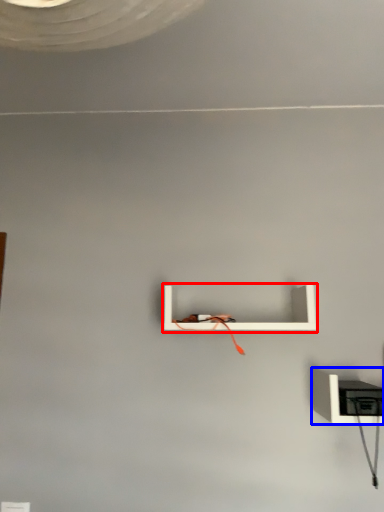
Question: Which object appears closest to the camera in this image, shelf (highlighted by a red box) or shelf (highlighted by a blue box)?

Choices:
 (A) shelf
 (B) shelf

Answer: (B)